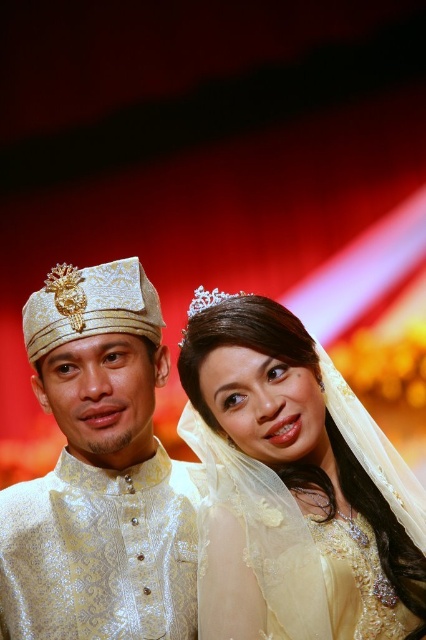
Does matte gold veil at center appear on the left side of clear crystal tiara at center?

Incorrect, matte gold veil at center is not on the left side of clear crystal tiara at center.

Consider the image. Who is positioned more to the left, matte gold veil at center or clear crystal tiara at center?

clear crystal tiara at center is more to the left.

The height and width of the screenshot is (640, 426). What are the coordinates of `matte gold veil at center` in the screenshot? It's located at (294, 488).

Is white brocade hat at upper left to the right of clear crystal tiara at upper center from the viewer's perspective?

No, white brocade hat at upper left is not to the right of clear crystal tiara at upper center.

Can you confirm if white brocade hat at upper left is wider than clear crystal tiara at upper center?

Indeed, white brocade hat at upper left has a greater width compared to clear crystal tiara at upper center.

Find the location of `white brocade hat at upper left`. white brocade hat at upper left is located at coordinates (100, 474).

Can you confirm if white brocade hat at upper left is wider than clear crystal tiara at center?

Yes.

Is point (26, 561) farther from camera compared to point (215, 305)?

Yes, point (26, 561) is behind point (215, 305).

Locate an element on the screen. Image resolution: width=426 pixels, height=640 pixels. white brocade hat at upper left is located at coordinates click(100, 474).